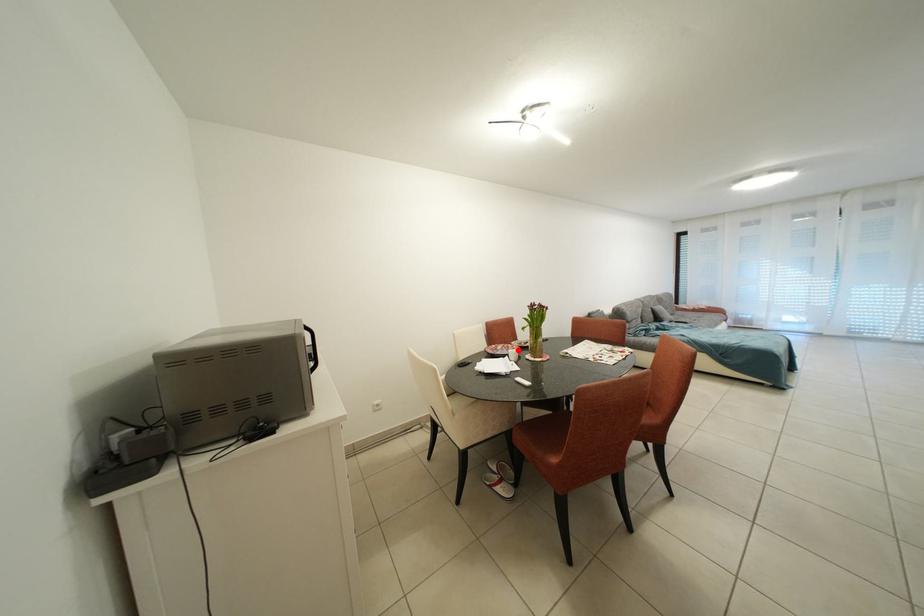
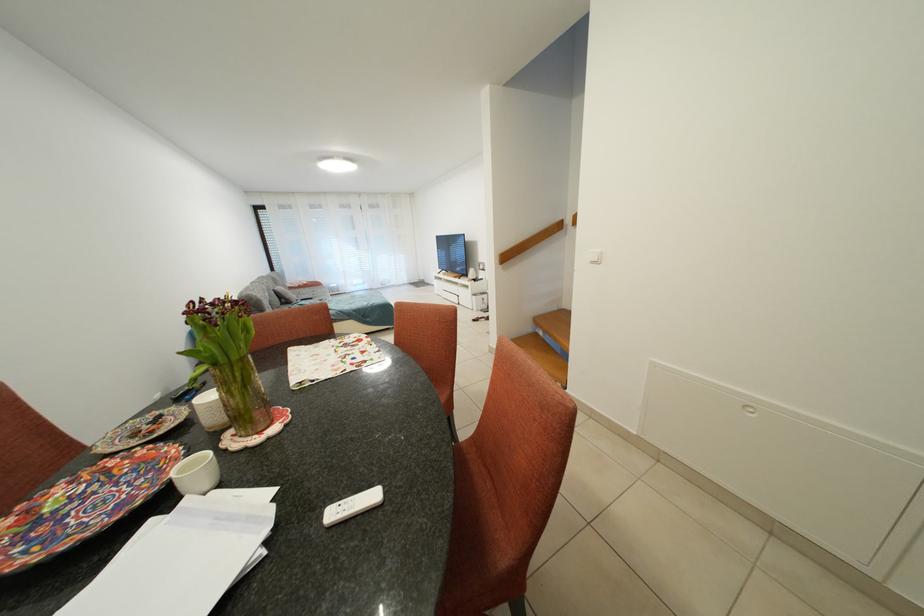
Find the pixel in the second image that matches the highlighted location in the first image.

(120, 467)